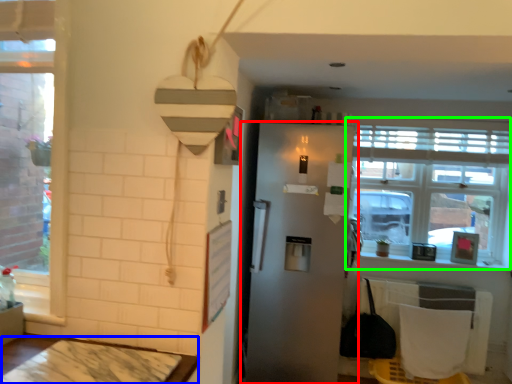
Question: Considering the real-world distances, which object is farthest from refrigerator (highlighted by a red box)? table (highlighted by a blue box) or window (highlighted by a green box)?

Choices:
 (A) table
 (B) window

Answer: (A)